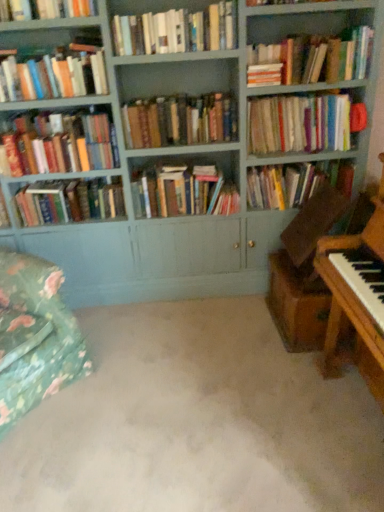
The image size is (384, 512). I want to click on free space above hardcover books at center, the 6th book when ordered from left to right (from a real-world perspective), so click(174, 94).